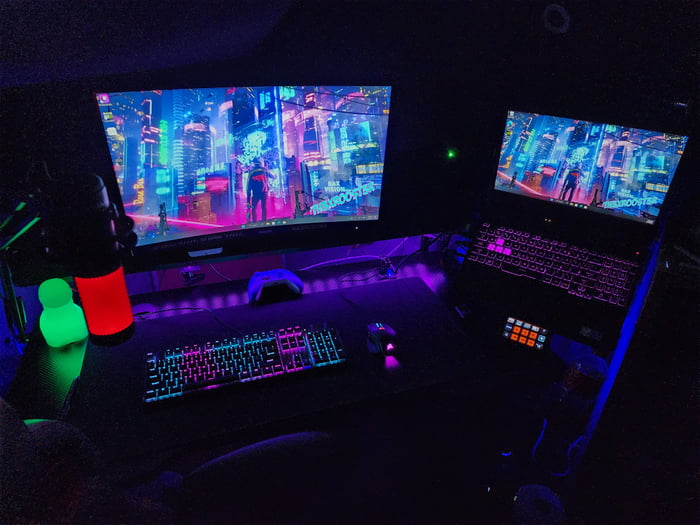
Find the location of a particular element. The height and width of the screenshot is (525, 700). mouse is located at coordinates (376, 345).